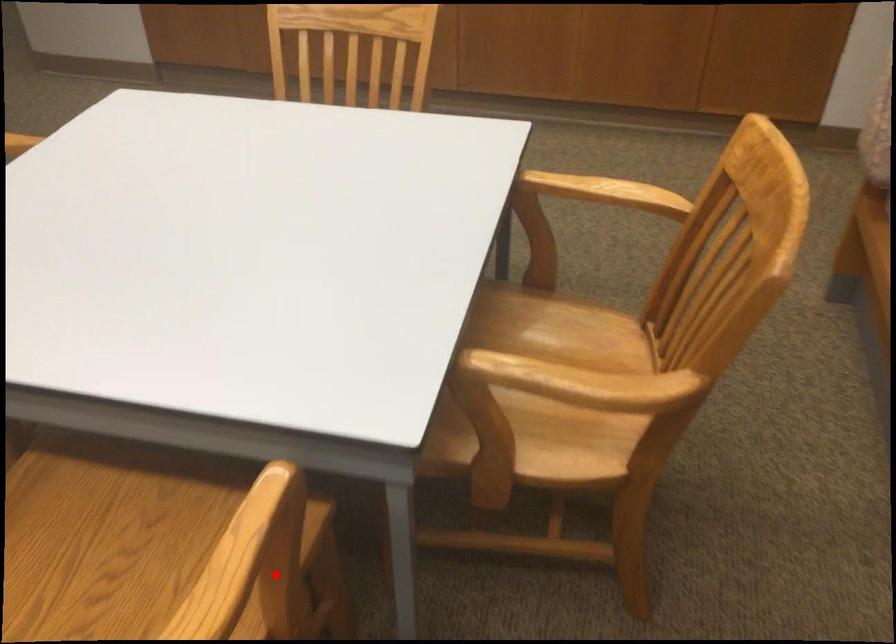
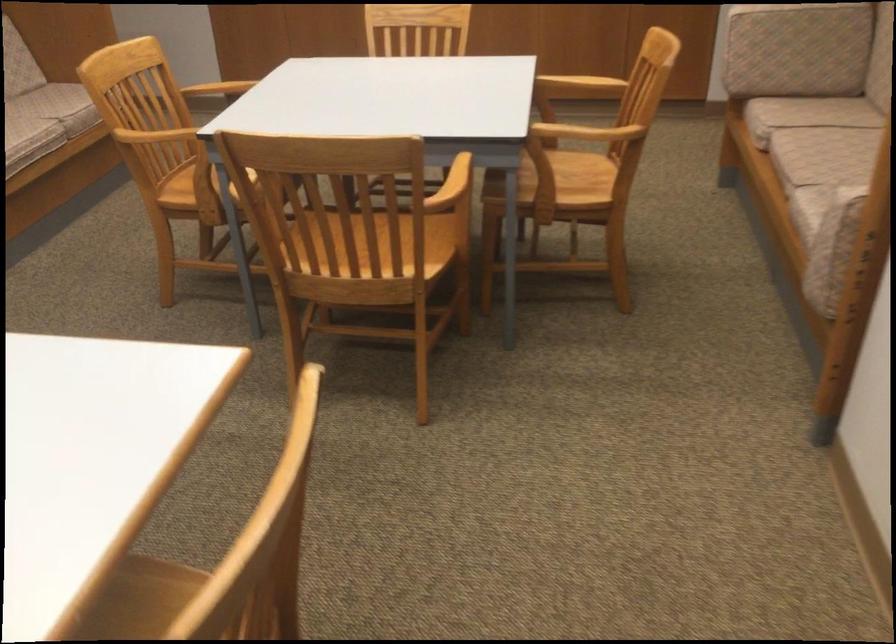
Question: I am providing you with two images of the same scene from different viewpoints. In image1, a red point is highlighted. Considering the same 3D point in image2, which of the following is correct?

Choices:
 (A) It is closer
 (B) It is farther

Answer: (B)